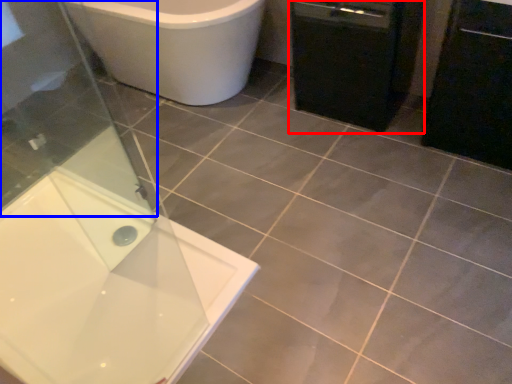
Question: Which of the following is the farthest to the observer, dish washer (highlighted by a red box) or screen door (highlighted by a blue box)?

Choices:
 (A) dish washer
 (B) screen door

Answer: (A)